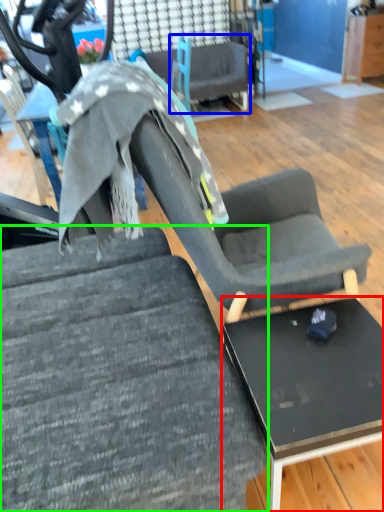
Question: Which object is the farthest from table (highlighted by a red box)? Choose among these: chair (highlighted by a blue box) or chair (highlighted by a green box).

Choices:
 (A) chair
 (B) chair

Answer: (A)